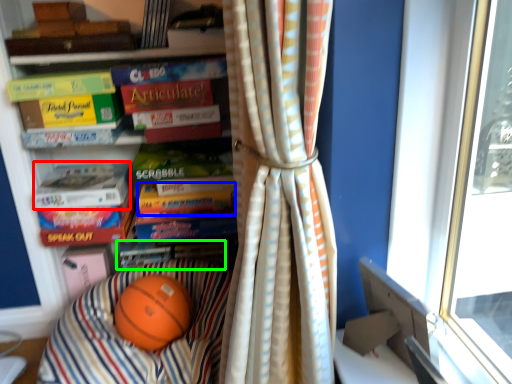
Question: Based on their relative distances, which object is farther from paperback book (highlighted by a red box)? Choose from paperback book (highlighted by a blue box) and book (highlighted by a green box).

Choices:
 (A) paperback book
 (B) book

Answer: (B)